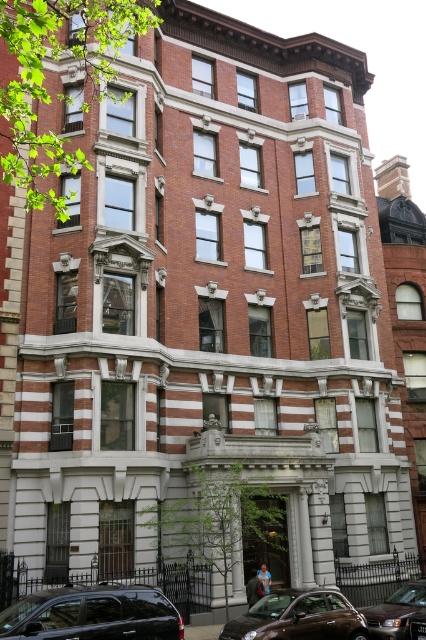
You are standing in front of the residential building and want to take a photo of the shiny black suv at lower left. Considering the distance, do you need a zoom lens to capture the entire vehicle in the frame?

The shiny black suv at lower left is 96.91 feet away from viewer. Since the suv is quite far away, you would need a zoom lens to ensure the entire vehicle fits within the camera frame.

You are a delivery person needing to park your vehicle in the parking space adjacent to the shiny brown car at lower center. The parking space is only wide enough for a standard sedan. Can your shiny black suv at lower left fit into this space?

The shiny black suv at lower left is wider than the shiny brown car at lower center. Since the parking space is designed for a standard sedan, which is typically narrower than an SUV, the shiny black suv at lower left may not fit properly in the space.

You are a delivery person trying to park your vehicle in front of the residential building. The shiny black suv at lower left and the shiny brown car at lower center are already parked there. Which vehicle would block the entrance less if you need to leave first?

The shiny brown car at lower center is shorter than the shiny black suv at lower left, so it would block the entrance less if you need to leave first.